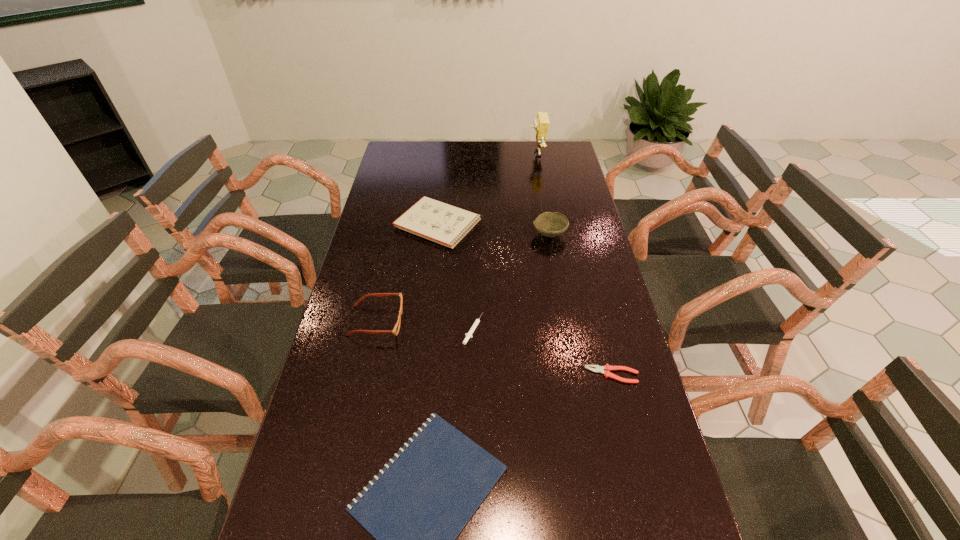
At what (x,y) coordinates should I click in order to perform the action: click on bowl that is at the right edge. Please return your answer as a coordinate pair (x, y). The width and height of the screenshot is (960, 540). Looking at the image, I should click on (548, 224).

This screenshot has width=960, height=540. In order to click on pliers situated at the right edge in this screenshot , I will do `click(599, 369)`.

This screenshot has height=540, width=960. Find the location of `object located at the far right corner`. object located at the far right corner is located at coordinates pyautogui.click(x=541, y=124).

This screenshot has width=960, height=540. I want to click on vacant region at the far edge of the desktop, so click(x=465, y=145).

Find the location of a particular element. free space at the left edge of the desktop is located at coordinates (412, 173).

Find the location of a particular element. The height and width of the screenshot is (540, 960). free location at the right edge of the desktop is located at coordinates (546, 201).

The width and height of the screenshot is (960, 540). In the image, there is a desktop. Identify the location of blank space at the far right corner. (543, 156).

Where is `free space that is in between the sixth shortest object and the pliers`? free space that is in between the sixth shortest object and the pliers is located at coordinates (581, 305).

The image size is (960, 540). I want to click on vacant space that's between the sponge and the second nearest object, so click(x=574, y=264).

Where is `free space between the fifth shortest object and the pliers`? This screenshot has height=540, width=960. free space between the fifth shortest object and the pliers is located at coordinates (494, 348).